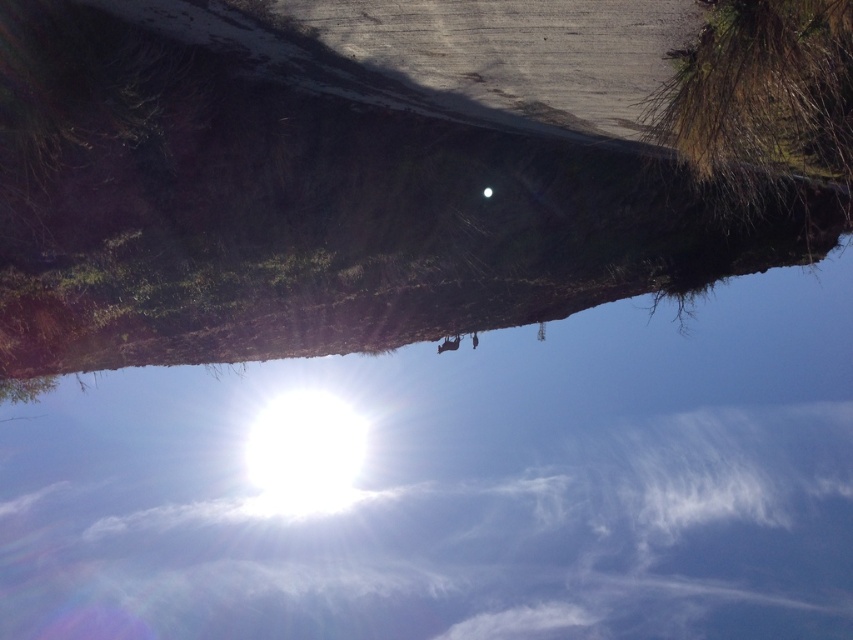
You are a hiker trying to find shade during the hottest part of the day. You see the transparent glass water at upper center and the green mossy tree at upper right. Which object would provide more shade?

The green mossy tree at upper right would provide more shade because the transparent glass water at upper center is positioned under it, meaning the tree is above and likely casting a larger shadow.

You are a hiker trying to locate the green mossy tree at upper right in the rotated image. From the transparent glass water at upper center, which direction should you move to reach the tree?

The transparent glass water at upper center is positioned on the left side of green mossy tree at upper right, so you should move to the right to reach the tree.